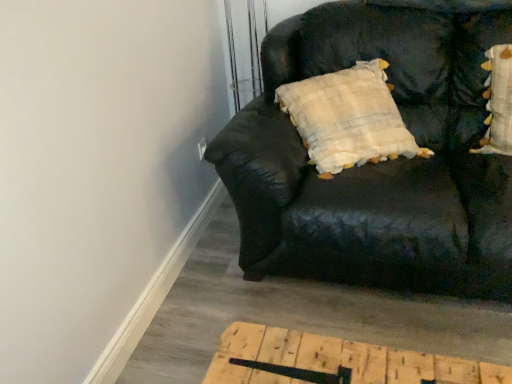
You are a GUI agent. You are given a task and a screenshot of the screen. Output one action in this format:
    pyautogui.click(x=<x>, y=<y>)
    Task: Click on the black leather couch at upper right
    
    Given the screenshot: What is the action you would take?
    pyautogui.click(x=379, y=163)

Describe the element at coordinates (379, 163) in the screenshot. I see `black leather couch at upper right` at that location.

What is the approximate width of black leather couch at upper right?

It is 3.56 feet.

Describe the element at coordinates (498, 102) in the screenshot. I see `fluffy white pillow with yellow accents at upper right` at that location.

This screenshot has width=512, height=384. In order to click on fluffy white pillow with yellow accents at upper right in this screenshot , I will do `click(498, 102)`.

The image size is (512, 384). Find the location of `black leather couch at upper right`. black leather couch at upper right is located at coordinates (379, 163).

Which object is positioned more to the right, fluffy white pillow with yellow accents at upper right or black leather couch at upper right?

From the viewer's perspective, fluffy white pillow with yellow accents at upper right appears more on the right side.

In the scene shown: Relative to black leather couch at upper right, is fluffy white pillow with yellow accents at upper right in front or behind?

Clearly, fluffy white pillow with yellow accents at upper right is behind black leather couch at upper right.

Does point (504, 79) appear closer or farther from the camera than point (257, 155)?

Point (504, 79) is positioned farther from the camera compared to point (257, 155).

From the image's perspective, is fluffy white pillow with yellow accents at upper right above black leather couch at upper right?

Yes.

From a real-world perspective, is fluffy white pillow with yellow accents at upper right physically above black leather couch at upper right?

Yes, from a real-world perspective, fluffy white pillow with yellow accents at upper right is over black leather couch at upper right

From the picture: Considering the relative sizes of fluffy white pillow with yellow accents at upper right and black leather couch at upper right in the image provided, is fluffy white pillow with yellow accents at upper right thinner than black leather couch at upper right?

Correct, the width of fluffy white pillow with yellow accents at upper right is less than that of black leather couch at upper right.

Between fluffy white pillow with yellow accents at upper right and black leather couch at upper right, which one has more height?

black leather couch at upper right is taller.

Considering the sizes of objects fluffy white pillow with yellow accents at upper right and black leather couch at upper right in the image provided, who is bigger, fluffy white pillow with yellow accents at upper right or black leather couch at upper right?

black leather couch at upper right.

From the picture: Is black leather couch at upper right inside fluffy white pillow with yellow accents at upper right?

No.

Is fluffy white pillow with yellow accents at upper right directly adjacent to black leather couch at upper right?

fluffy white pillow with yellow accents at upper right is not next to black leather couch at upper right, and they're not touching.

Is fluffy white pillow with yellow accents at upper right facing away from black leather couch at upper right?

Yes, fluffy white pillow with yellow accents at upper right is positioned with its back facing black leather couch at upper right.

At what (x,y) coordinates should I click in order to perform the action: click on pillow behind the black leather couch at upper right. Please return your answer as a coordinate pair (x, y). The image size is (512, 384). Looking at the image, I should click on (498, 102).

Considering the relative positions of black leather couch at upper right and fluffy white pillow with yellow accents at upper right in the image provided, is black leather couch at upper right to the left or to the right of fluffy white pillow with yellow accents at upper right?

Based on their positions, black leather couch at upper right is located to the left of fluffy white pillow with yellow accents at upper right.

Is black leather couch at upper right behind fluffy white pillow with yellow accents at upper right?

No, the depth of black leather couch at upper right is less than that of fluffy white pillow with yellow accents at upper right.

Which is further, (436, 201) or (510, 131)?

The point (510, 131) is farther.

From the image's perspective, which is above, black leather couch at upper right or fluffy white pillow with yellow accents at upper right?

fluffy white pillow with yellow accents at upper right is shown above in the image.

From a real-world perspective, is black leather couch at upper right positioned under fluffy white pillow with yellow accents at upper right based on gravity?

Yes, from a real-world perspective, black leather couch at upper right is under fluffy white pillow with yellow accents at upper right.

In terms of width, does black leather couch at upper right look wider or thinner when compared to fluffy white pillow with yellow accents at upper right?

Considering their sizes, black leather couch at upper right looks broader than fluffy white pillow with yellow accents at upper right.

Considering the relative sizes of black leather couch at upper right and fluffy white pillow with yellow accents at upper right in the image provided, is black leather couch at upper right taller than fluffy white pillow with yellow accents at upper right?

Correct, black leather couch at upper right is much taller as fluffy white pillow with yellow accents at upper right.

Which of these two, black leather couch at upper right or fluffy white pillow with yellow accents at upper right, is bigger?

black leather couch at upper right is bigger.

Is black leather couch at upper right positioned beyond the bounds of fluffy white pillow with yellow accents at upper right?

Yes, black leather couch at upper right is not within fluffy white pillow with yellow accents at upper right.

Would you say black leather couch at upper right is a long distance from fluffy white pillow with yellow accents at upper right?

black leather couch at upper right is near fluffy white pillow with yellow accents at upper right, not far away.

Is black leather couch at upper right looking in the opposite direction of fluffy white pillow with yellow accents at upper right?

Absolutely, black leather couch at upper right is directed away from fluffy white pillow with yellow accents at upper right.

How different are the orientations of black leather couch at upper right and fluffy white pillow with yellow accents at upper right in degrees?

6.77 degrees separate the facing orientations of black leather couch at upper right and fluffy white pillow with yellow accents at upper right.

This screenshot has height=384, width=512. What are the coordinates of `pillow above the black leather couch at upper right (from the image's perspective)` in the screenshot? It's located at (498, 102).

At what (x,y) coordinates should I click in order to perform the action: click on studio couch in front of the fluffy white pillow with yellow accents at upper right. Please return your answer as a coordinate pair (x, y). Looking at the image, I should click on (379, 163).

You are a GUI agent. You are given a task and a screenshot of the screen. Output one action in this format:
    pyautogui.click(x=<x>, y=<y>)
    Task: Click on the pillow above the black leather couch at upper right (from a real-world perspective)
    
    Given the screenshot: What is the action you would take?
    pyautogui.click(x=498, y=102)